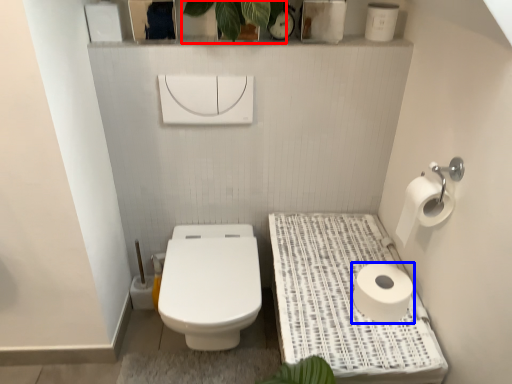
Question: Which object is further to the camera taking this photo, plant (highlighted by a red box) or toilet paper (highlighted by a blue box)?

Choices:
 (A) plant
 (B) toilet paper

Answer: (B)